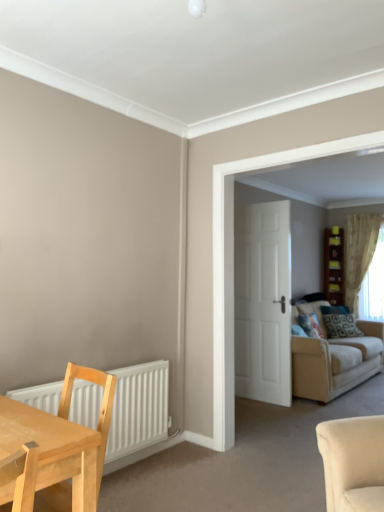
Question: From a real-world perspective, is patterned fabric pillow at center-right under beige fabric couch at right?

Choices:
 (A) yes
 (B) no

Answer: (B)

Question: Does patterned fabric pillow at center-right have a lesser width compared to beige fabric couch at right?

Choices:
 (A) yes
 (B) no

Answer: (A)

Question: Could beige fabric couch at right be considered to be inside patterned fabric pillow at center-right?

Choices:
 (A) yes
 (B) no

Answer: (B)

Question: Considering the relative positions of patterned fabric pillow at center-right and beige fabric couch at right in the image provided, is patterned fabric pillow at center-right behind beige fabric couch at right?

Choices:
 (A) no
 (B) yes

Answer: (B)

Question: Considering the relative positions of patterned fabric pillow at center-right and beige fabric couch at right in the image provided, is patterned fabric pillow at center-right to the left of beige fabric couch at right from the viewer's perspective?

Choices:
 (A) no
 (B) yes

Answer: (A)

Question: Considering the positions of white matte radiator at lower left and brown wooden bookshelf at center-right in the image, is white matte radiator at lower left bigger or smaller than brown wooden bookshelf at center-right?

Choices:
 (A) big
 (B) small

Answer: (B)

Question: Considering their positions, is white matte radiator at lower left located in front of or behind brown wooden bookshelf at center-right?

Choices:
 (A) front
 (B) behind

Answer: (A)

Question: Would you say white matte radiator at lower left is to the left or to the right of brown wooden bookshelf at center-right in the picture?

Choices:
 (A) right
 (B) left

Answer: (B)

Question: From a real-world perspective, is white matte radiator at lower left above or below brown wooden bookshelf at center-right?

Choices:
 (A) below
 (B) above

Answer: (A)

Question: Visually, is brown wooden bookshelf at center-right positioned to the left or to the right of light wood table at lower left?

Choices:
 (A) left
 (B) right

Answer: (B)

Question: Based on their sizes in the image, would you say brown wooden bookshelf at center-right is bigger or smaller than light wood table at lower left?

Choices:
 (A) big
 (B) small

Answer: (B)

Question: From the image's perspective, relative to light wood table at lower left, is brown wooden bookshelf at center-right above or below?

Choices:
 (A) above
 (B) below

Answer: (A)

Question: Is brown wooden bookshelf at center-right in front of or behind light wood table at lower left in the image?

Choices:
 (A) behind
 (B) front

Answer: (A)

Question: From the image's perspective, relative to patterned fabric pillow at center-right, is light wood table at lower left above or below?

Choices:
 (A) below
 (B) above

Answer: (B)

Question: Visually, is light wood table at lower left positioned to the left or to the right of patterned fabric pillow at center-right?

Choices:
 (A) left
 (B) right

Answer: (A)